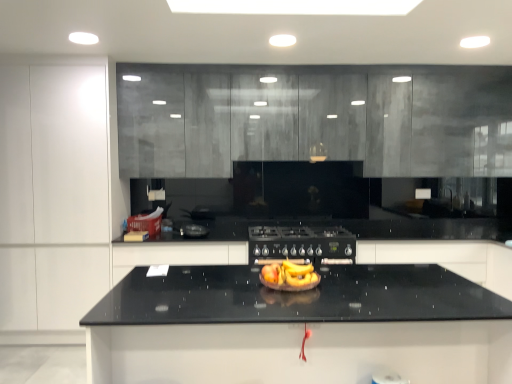
Question: Considering the relative positions of black granite countertop at center and black glossy countertop at center, which is the 2th cabinetry from left to right, in the image provided, is black granite countertop at center to the left or to the right of black glossy countertop at center, which is the 2th cabinetry from left to right,?

Choices:
 (A) right
 (B) left

Answer: (A)

Question: From a real-world perspective, is black granite countertop at center above or below black glossy countertop at center, placed as the third cabinetry when sorted from right to left?

Choices:
 (A) below
 (B) above

Answer: (A)

Question: Considering the real-world distances, which object is farthest from the yellow matte bananas at center?

Choices:
 (A) black glossy countertop at center, which is the 2th cabinetry from left to right
 (B) matte gray cabinets at upper center, the 3th cabinetry when ordered from left to right
 (C) black matte gas stove at center
 (D) black granite countertop at center, which appears as the first cabinetry when viewed from the right
 (E) black granite countertop at center

Answer: (B)

Question: Which of these objects is positioned closest to the white matte cabinet at left, which ranks as the 1th cabinetry in left-to-right order?

Choices:
 (A) black matte gas stove at center
 (B) black granite countertop at center
 (C) black granite countertop at center, which appears as the first cabinetry when viewed from the right
 (D) black glossy countertop at center, placed as the third cabinetry when sorted from right to left
 (E) yellow matte bananas at center

Answer: (D)